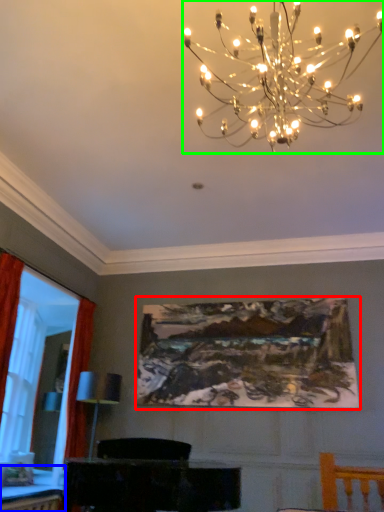
Question: Considering the real-world distances, which object is closest to picture frame (highlighted by a red box)? table (highlighted by a blue box) or lamp (highlighted by a green box).

Choices:
 (A) table
 (B) lamp

Answer: (A)